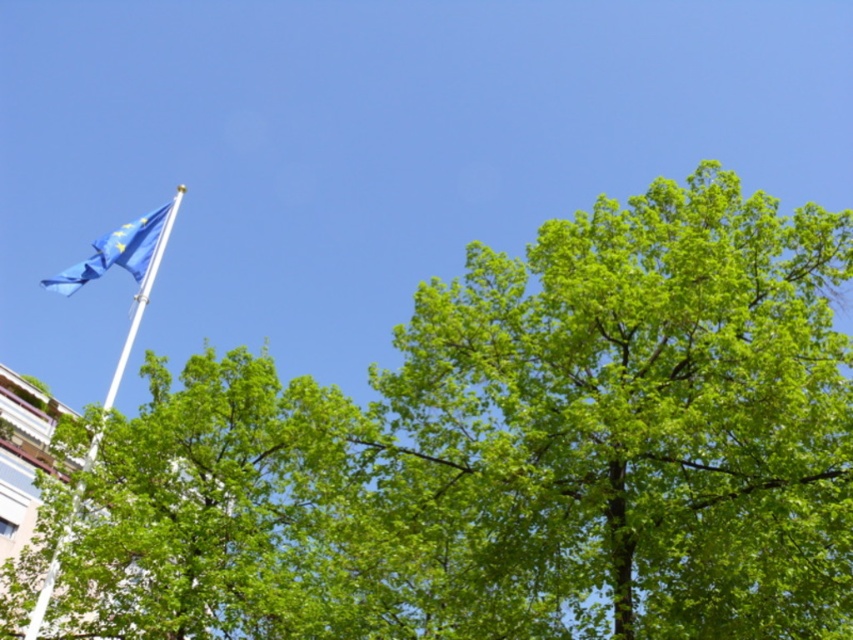
Which is behind, point (96, 529) or point (91, 445)?

Positioned behind is point (91, 445).

Which is below, green leafy tree at upper left or white metallic flag pole at upper left?

green leafy tree at upper left is lower down.

Is point (335, 497) behind point (140, 230)?

No, (335, 497) is closer to viewer.

Image resolution: width=853 pixels, height=640 pixels. In order to click on green leafy tree at upper left in this screenshot , I will do `click(215, 509)`.

Is point (762, 243) in front of point (131, 337)?

Yes, point (762, 243) is in front of point (131, 337).

Does green leafy tree at center have a greater width compared to white metallic flag pole at upper left?

No, green leafy tree at center is not wider than white metallic flag pole at upper left.

Is point (697, 625) more distant than point (152, 216)?

No, it is in front of (152, 216).

At what (x,y) coordinates should I click in order to perform the action: click on green leafy tree at center. Please return your answer as a coordinate pair (x, y). Image resolution: width=853 pixels, height=640 pixels. Looking at the image, I should click on (630, 426).

Does green leafy tree at upper left have a greater height compared to blue fabric flag at upper left?

Incorrect, green leafy tree at upper left's height is not larger of blue fabric flag at upper left's.

Measure the distance between green leafy tree at upper left and blue fabric flag at upper left.

A distance of 5.86 meters exists between green leafy tree at upper left and blue fabric flag at upper left.

The height and width of the screenshot is (640, 853). What do you see at coordinates (215, 509) in the screenshot?
I see `green leafy tree at upper left` at bounding box center [215, 509].

Locate an element on the screen. green leafy tree at upper left is located at coordinates (215, 509).